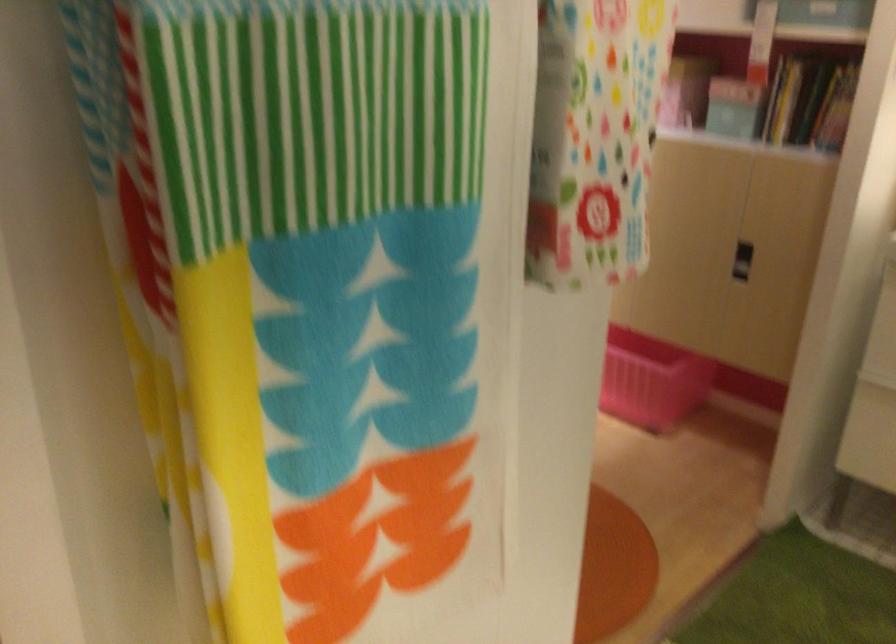
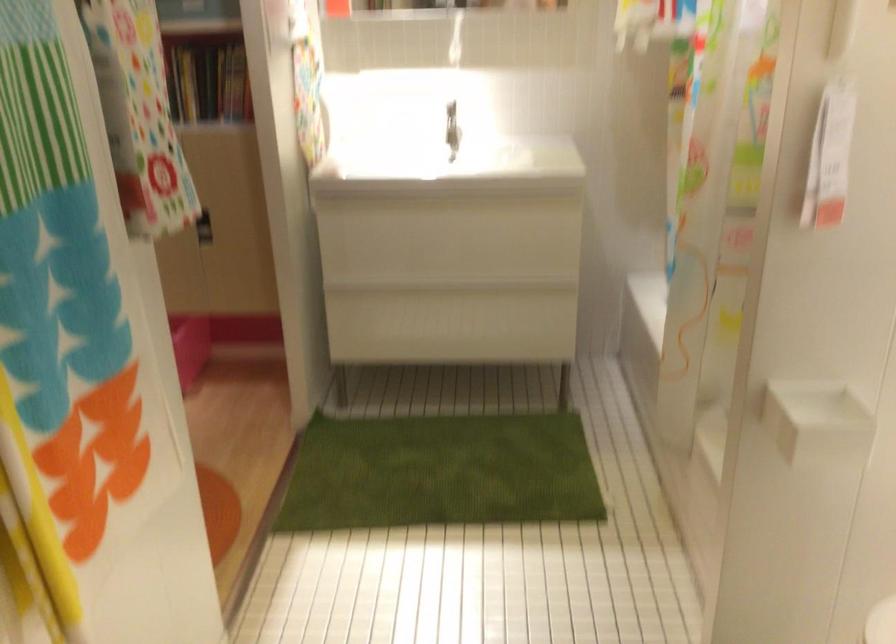
Question: The camera is either moving clockwise (left) or counter-clockwise (right) around the object. The first image is from the beginning of the video and the second image is from the end. Is the camera moving left or right when shooting the video?

Choices:
 (A) Left
 (B) Right

Answer: (A)